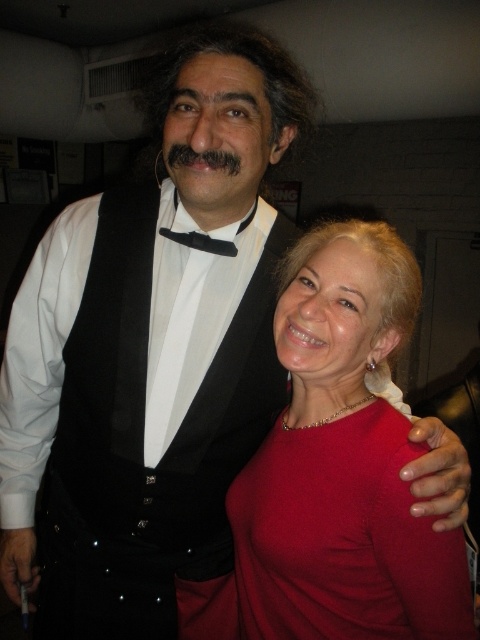
You are a photographer setting up for a portrait session. You need to ensure that the matte red dress at center and the black satin bow tie at center are both visible in the frame. Based on their sizes, which object should you focus on to ensure both are in focus?

The matte red dress at center has a greater height compared to the black satin bow tie at center, so focusing on the matte red dress at center would ensure both are in focus since it is larger and occupies more space in the frame.

You are a photographer setting up for a group photo. You have a matte red dress at center and a black fuzzy mustache at center in your frame. The camera you are using has a minimum focus distance of 15 inches. Can you focus on both objects without moving the camera or subjects?

The matte red dress at center is 17.15 inches from the black fuzzy mustache at center. Since the distance between them is greater than the camera minimum focus distance of 15 inches, the camera can focus on both objects without needing to adjust the camera or subjects.

You are a photographer adjusting the lighting for a portrait. You need to ensure that both the black fuzzy mustache at center and the black satin bow tie at center are well lit. Based on their positions, which one is closer to the right side of the bow tie?

The black fuzzy mustache at center is positioned on the right side of the black satin bow tie at center, so it is closer to the right side of the bow tie.